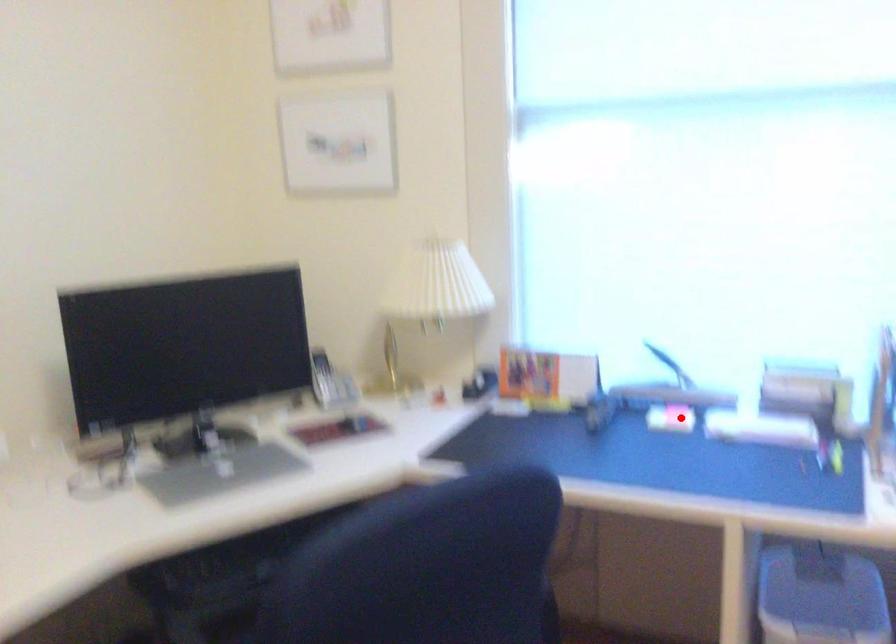
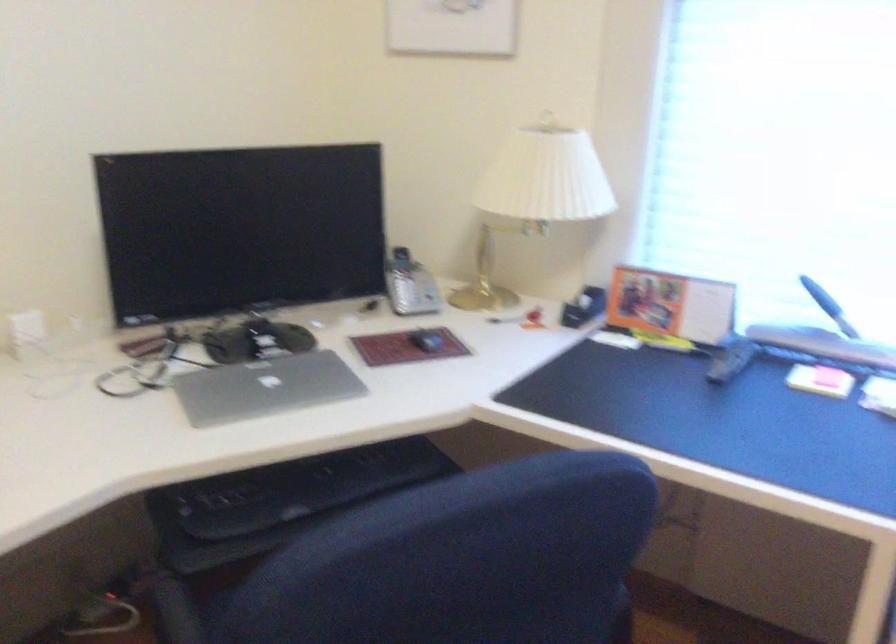
In the second image, find the point that corresponds to the highlighted location in the first image.

(829, 377)